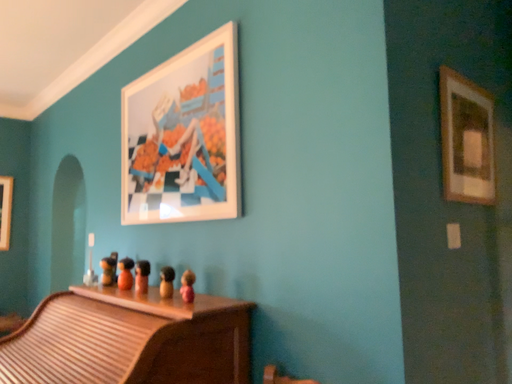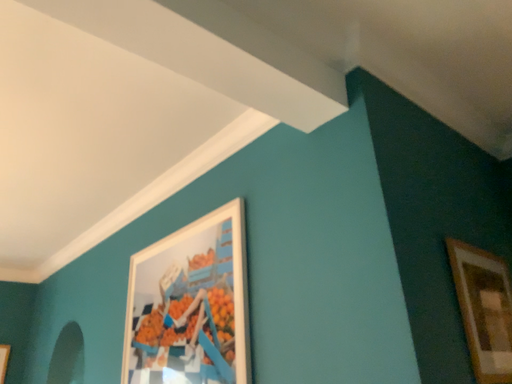
Question: Which way did the camera rotate in the video?

Choices:
 (A) rotated downward
 (B) rotated upward

Answer: (B)